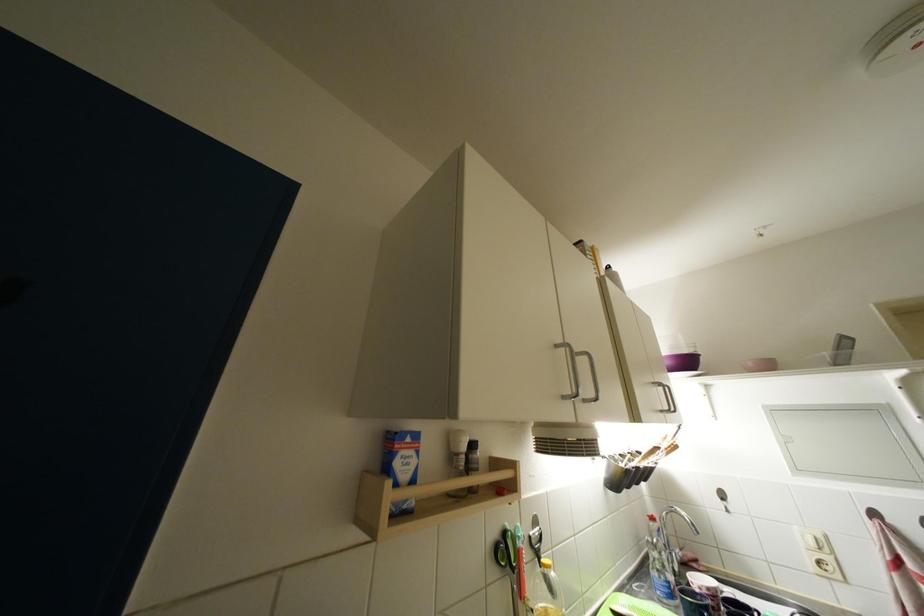
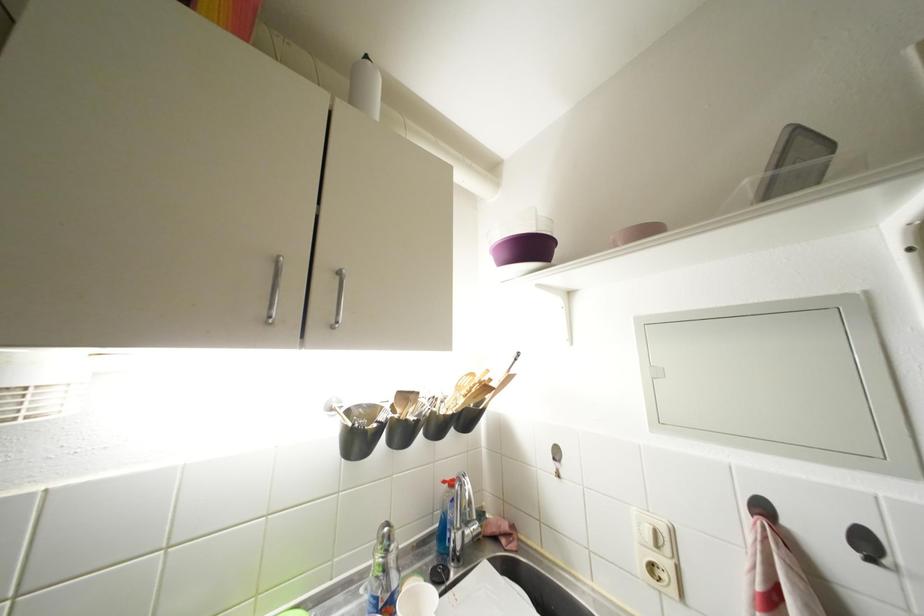
In the second image, find the point that corresponds to (675,367) in the first image.

(512, 259)